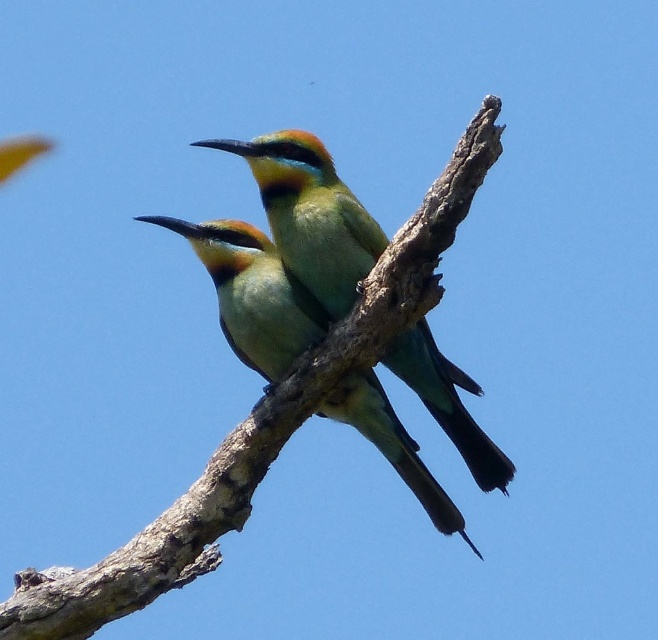
Question: Does brown rough branch at center appear under green glossy bee-eater at center?

Choices:
 (A) yes
 (B) no

Answer: (A)

Question: Which point is farther from the camera taking this photo?

Choices:
 (A) (345, 289)
 (B) (203, 492)

Answer: (B)

Question: Can you confirm if brown rough branch at center is positioned to the right of green glossy bee-eater at center?

Choices:
 (A) yes
 (B) no

Answer: (B)

Question: Which object is farther from the camera taking this photo?

Choices:
 (A) green glossy bee-eater at center
 (B) brown rough branch at center

Answer: (A)

Question: Observing the image, what is the correct spatial positioning of brown rough branch at center in reference to green glossy bee-eater at center?

Choices:
 (A) right
 (B) left

Answer: (B)

Question: Which of the following is the closest to the observer?

Choices:
 (A) (503, 461)
 (B) (468, 140)

Answer: (B)